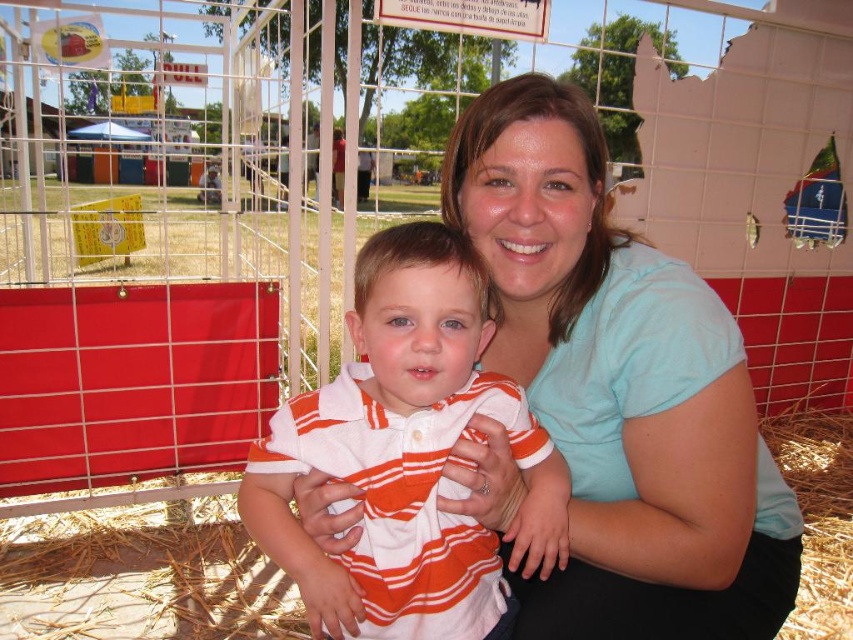
Locate an element on the screen. light blue shirt at center is located at coordinates (619, 388).